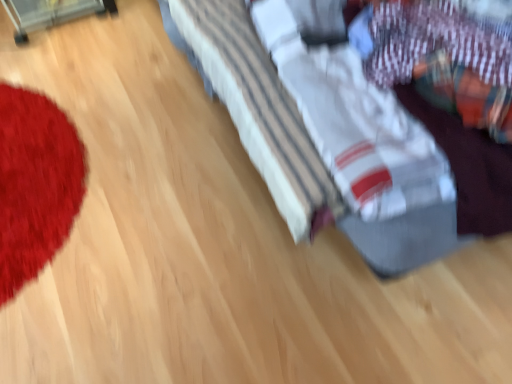
This screenshot has height=384, width=512. I want to click on vacant area that lies to the right of fluffy red rug at left, so click(x=162, y=171).